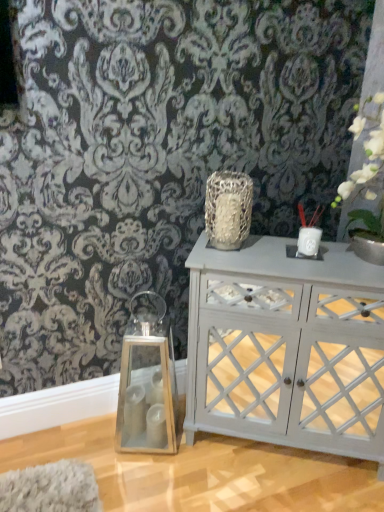
Question: Does white ceramic candle holder at upper right, which ranks as the second candle holder in top-to-bottom order, have a greater width compared to white matte vase at upper right?

Choices:
 (A) yes
 (B) no

Answer: (B)

Question: From a real-world perspective, is white ceramic candle holder at upper right, acting as the 2th candle holder starting from the bottom, physically above white matte vase at upper right?

Choices:
 (A) yes
 (B) no

Answer: (B)

Question: From a real-world perspective, is white ceramic candle holder at upper right, acting as the 2th candle holder starting from the bottom, below white matte vase at upper right?

Choices:
 (A) no
 (B) yes

Answer: (B)

Question: Is white matte vase at upper right at the back of white ceramic candle holder at upper right, acting as the 2th candle holder starting from the bottom?

Choices:
 (A) yes
 (B) no

Answer: (B)

Question: Is white ceramic candle holder at upper right, arranged as the second candle holder when viewed from the left, completely or partially outside of white matte vase at upper right?

Choices:
 (A) no
 (B) yes

Answer: (B)

Question: Is white matte vase at upper right surrounded by white ceramic candle holder at upper right, which ranks as the second candle holder in top-to-bottom order?

Choices:
 (A) no
 (B) yes

Answer: (A)

Question: Is textured silver vase at center not close to white ceramic vase at upper right, positioned as the first candle holder in right-to-left order?

Choices:
 (A) yes
 (B) no

Answer: (B)

Question: From the image's perspective, is textured silver vase at center located above white ceramic vase at upper right, arranged as the 3th candle holder when ordered from the bottom?

Choices:
 (A) yes
 (B) no

Answer: (A)

Question: Does textured silver vase at center lie in front of white ceramic vase at upper right, arranged as the first candle holder when viewed from the top?

Choices:
 (A) yes
 (B) no

Answer: (A)

Question: Is textured silver vase at center turned away from white ceramic vase at upper right, arranged as the first candle holder when viewed from the top?

Choices:
 (A) yes
 (B) no

Answer: (B)

Question: Considering the relative sizes of textured silver vase at center and white ceramic vase at upper right, arranged as the first candle holder when viewed from the top, in the image provided, is textured silver vase at center thinner than white ceramic vase at upper right, arranged as the first candle holder when viewed from the top,?

Choices:
 (A) no
 (B) yes

Answer: (A)

Question: From a real-world perspective, does textured silver vase at center sit lower than white ceramic vase at upper right, the third candle holder positioned from the left?

Choices:
 (A) yes
 (B) no

Answer: (B)

Question: Considering the relative sizes of textured silver vase at center and white painted wood cabinet at center in the image provided, is textured silver vase at center bigger than white painted wood cabinet at center?

Choices:
 (A) yes
 (B) no

Answer: (B)